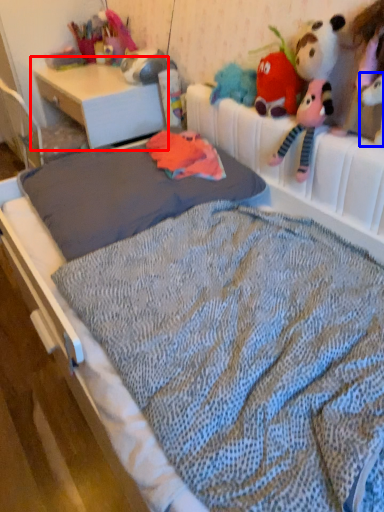
Question: Which point is further to the camera, desk (highlighted by a red box) or toy (highlighted by a blue box)?

Choices:
 (A) desk
 (B) toy

Answer: (A)